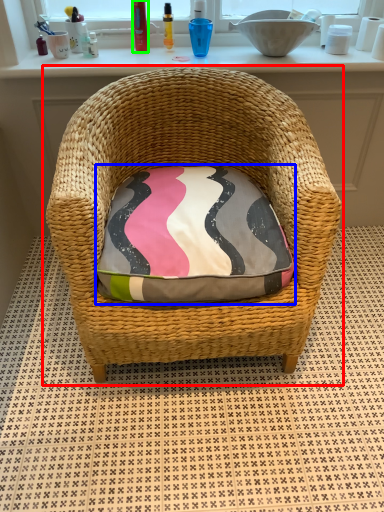
Question: Estimate the real-world distances between objects in this image. Which object is farther from chair (highlighted by a red box), throw pillow (highlighted by a blue box) or toiletry (highlighted by a green box)?

Choices:
 (A) throw pillow
 (B) toiletry

Answer: (B)